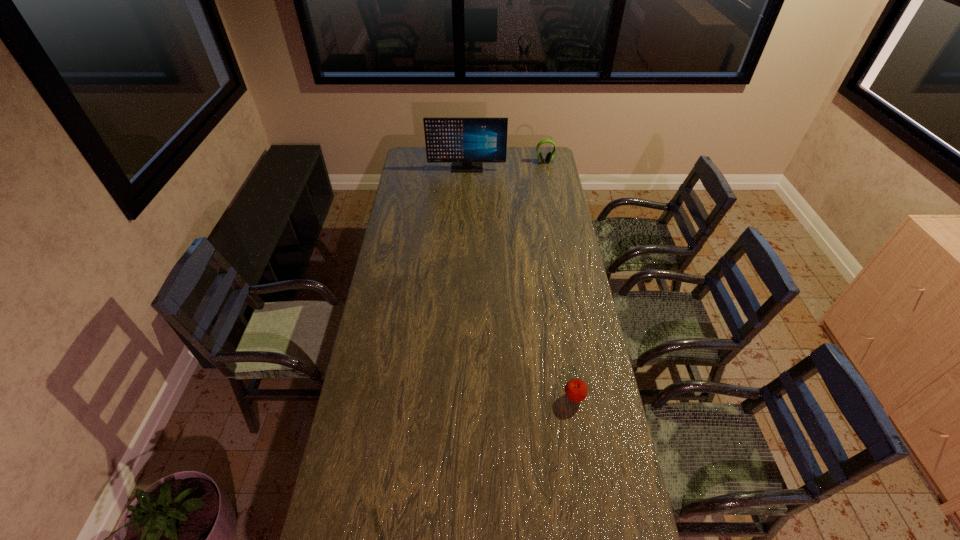
Image resolution: width=960 pixels, height=540 pixels. I want to click on computer monitor, so click(x=467, y=143).

This screenshot has height=540, width=960. In order to click on the leftmost object in this screenshot , I will do `click(467, 143)`.

The height and width of the screenshot is (540, 960). I want to click on the second shortest object, so click(549, 156).

Identify the location of the shortest object. This screenshot has width=960, height=540. (576, 390).

Identify the location of apple. This screenshot has height=540, width=960. (576, 390).

This screenshot has height=540, width=960. In order to click on free space located 0.220m on the screen side of the computer monitor in this screenshot , I will do `click(466, 195)`.

Locate an element on the screen. The image size is (960, 540). free space located on the left of the headset is located at coordinates (478, 162).

Identify the location of vacant space located 0.400m on the front of the nearest object. (597, 538).

You are a GUI agent. You are given a task and a screenshot of the screen. Output one action in this format:
    pyautogui.click(x=<x>, y=<y>)
    Task: Click on the computer monitor at the far edge
    The image size is (960, 540).
    Given the screenshot: What is the action you would take?
    pyautogui.click(x=467, y=143)

Identify the location of headset at the far edge. (549, 156).